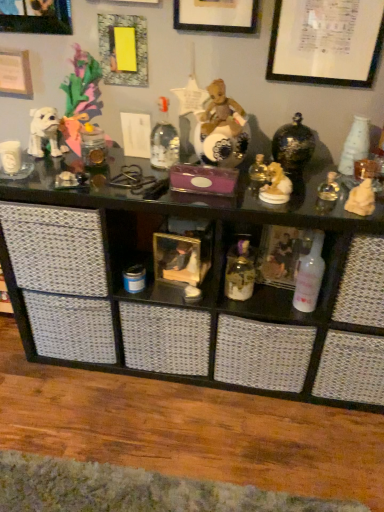
Question: Is yellow paper at upper left, which is counted as the 3th picture frame, starting from the left, aimed at white paper at upper right, marked as the 1th picture frame in a right-to-left arrangement?

Choices:
 (A) no
 (B) yes

Answer: (A)

Question: Are yellow paper at upper left, which is the third picture frame in right-to-left order, and white paper at upper right, marked as the 1th picture frame in a right-to-left arrangement, far apart?

Choices:
 (A) no
 (B) yes

Answer: (A)

Question: Is yellow paper at upper left, which is the third picture frame in right-to-left order, positioned with its back to white paper at upper right, marked as the 1th picture frame in a right-to-left arrangement?

Choices:
 (A) no
 (B) yes

Answer: (A)

Question: From a real-world perspective, is yellow paper at upper left, which is the third picture frame in right-to-left order, positioned under white paper at upper right, placed as the 5th picture frame when sorted from left to right, based on gravity?

Choices:
 (A) no
 (B) yes

Answer: (B)

Question: Is yellow paper at upper left, which is the third picture frame in right-to-left order, wider than white paper at upper right, marked as the 1th picture frame in a right-to-left arrangement?

Choices:
 (A) yes
 (B) no

Answer: (A)

Question: In terms of height, does translucent glass jar at center look taller or shorter compared to white glossy bottle at center-right?

Choices:
 (A) short
 (B) tall

Answer: (A)

Question: In terms of size, does translucent glass jar at center appear bigger or smaller than white glossy bottle at center-right?

Choices:
 (A) big
 (B) small

Answer: (B)

Question: Considering their positions, is translucent glass jar at center located in front of or behind white glossy bottle at center-right?

Choices:
 (A) behind
 (B) front

Answer: (A)

Question: Visually, is translucent glass jar at center positioned to the left or to the right of white glossy bottle at center-right?

Choices:
 (A) right
 (B) left

Answer: (B)

Question: Based on their positions, is gold ceramic dog at upper right, the 1th toy positioned from the left, located to the left or right of brushed metal picture frame at upper left, placed as the second picture frame when sorted from left to right?

Choices:
 (A) right
 (B) left

Answer: (A)

Question: Which is correct: gold ceramic dog at upper right, the 2th toy positioned from the right, is inside brushed metal picture frame at upper left, the fourth picture frame when ordered from right to left, or outside of it?

Choices:
 (A) outside
 (B) inside

Answer: (A)

Question: From the image's perspective, is gold ceramic dog at upper right, the 1th toy positioned from the left, positioned above or below brushed metal picture frame at upper left, the fourth picture frame when ordered from right to left?

Choices:
 (A) above
 (B) below

Answer: (B)

Question: In terms of size, does gold ceramic dog at upper right, the 2th toy positioned from the right, appear bigger or smaller than brushed metal picture frame at upper left, the fourth picture frame when ordered from right to left?

Choices:
 (A) small
 (B) big

Answer: (A)

Question: In the image, is white paper at upper left, the 1th picture frame in the left-to-right sequence, positioned in front of or behind white glossy bottle at center-right?

Choices:
 (A) front
 (B) behind

Answer: (B)

Question: From a real-world perspective, is white paper at upper left, the 1th picture frame in the left-to-right sequence, positioned above or below white glossy bottle at center-right?

Choices:
 (A) below
 (B) above

Answer: (B)